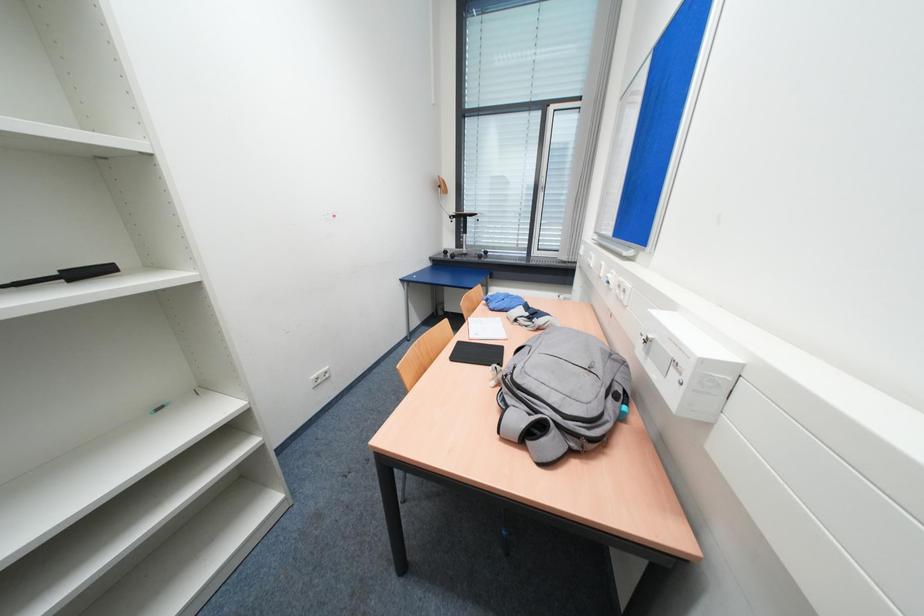
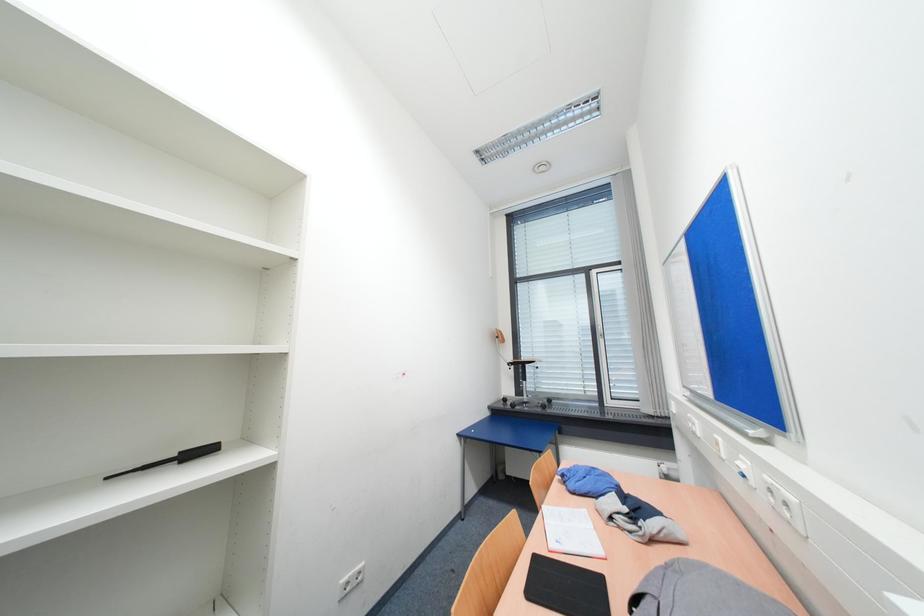
Question: Based on the continuous images, in which direction is the camera rotating? Reply with the corresponding letter.

Choices:
 (A) Left
 (B) Right
 (C) Up
 (D) Down

Answer: (C)